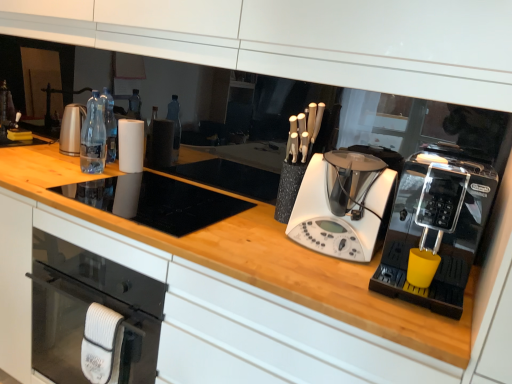
Question: In terms of size, does white matte paper towel at center appear bigger or smaller than black plastic coffee machine at right, which is the 1th home appliance from right to left?

Choices:
 (A) small
 (B) big

Answer: (A)

Question: Considering their positions, is white matte paper towel at center located in front of or behind black plastic coffee machine at right, which is the 1th home appliance from right to left?

Choices:
 (A) behind
 (B) front

Answer: (A)

Question: Estimate the real-world distances between objects in this image. Which object is farther from the white plastic blender at center, acting as the second home appliance starting from the right?

Choices:
 (A) clear plastic bottles at center
 (B) white matte paper towel at center
 (C) black plastic coffee machine at right, which is the 1th home appliance from right to left

Answer: (A)

Question: Based on their relative distances, which object is nearer to the clear plastic bottles at center?

Choices:
 (A) white plastic blender at center, which ranks as the 1th home appliance in left-to-right order
 (B) black plastic coffee machine at right, arranged as the second home appliance when viewed from the left
 (C) white matte paper towel at center

Answer: (C)